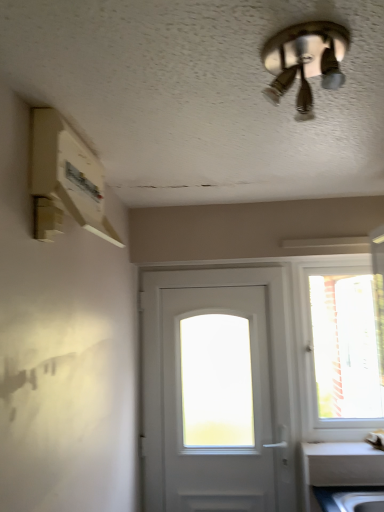
Image resolution: width=384 pixels, height=512 pixels. Describe the element at coordinates (305, 61) in the screenshot. I see `metallic silver ceiling fan at upper center` at that location.

What is the approximate width of transparent glass window at right?

3.34 inches.

I want to click on metallic silver ceiling fan at upper center, so click(305, 61).

Is the surface of white matte door at center in direct contact with transparent glass window at right?

white matte door at center and transparent glass window at right are not in contact.

Which object is positioned more to the right, white matte door at center or transparent glass window at right?

transparent glass window at right is more to the right.

Is white matte door at center shorter than transparent glass window at right?

No.

Is metallic silver ceiling fan at upper center not near transparent glass window at right?

Yes, metallic silver ceiling fan at upper center and transparent glass window at right are quite far apart.

Based on the photo, from the image's perspective, which is below, metallic silver ceiling fan at upper center or transparent glass window at right?

transparent glass window at right appears lower in the image.

How different are the orientations of metallic silver ceiling fan at upper center and transparent glass window at right in degrees?

The facing directions of metallic silver ceiling fan at upper center and transparent glass window at right are 86.8 degrees apart.

Between metallic silver ceiling fan at upper center and transparent glass window at right, which one has more height?

With more height is transparent glass window at right.

Are metallic silver ceiling fan at upper center and white matte door at center far apart?

Yes, metallic silver ceiling fan at upper center and white matte door at center are located far from each other.

Is point (288, 51) positioned behind point (161, 355)?

No, it is not.

Which object is thinner, metallic silver ceiling fan at upper center or white matte door at center?

Thinner between the two is white matte door at center.

Who is smaller, metallic silver ceiling fan at upper center or white matte door at center?

With smaller size is metallic silver ceiling fan at upper center.

How many degrees apart are the facing directions of white matte door at center and metallic silver ceiling fan at upper center?

The facing directions of white matte door at center and metallic silver ceiling fan at upper center are 86.4 degrees apart.

Can you confirm if white matte door at center is taller than metallic silver ceiling fan at upper center?

Correct, white matte door at center is much taller as metallic silver ceiling fan at upper center.

Is white matte door at center surrounding metallic silver ceiling fan at upper center?

No, metallic silver ceiling fan at upper center is not a part of white matte door at center.

Would you say white matte door at center is a long distance from metallic silver ceiling fan at upper center?

Yes, white matte door at center is far from metallic silver ceiling fan at upper center.

Can you tell me how much transparent glass window at right and white matte door at center differ in facing direction?

transparent glass window at right and white matte door at center are facing 0.37 degrees away from each other.

Which is correct: transparent glass window at right is inside white matte door at center, or outside of it?

transparent glass window at right is spatially situated outside white matte door at center.

Does transparent glass window at right appear on the right side of white matte door at center?

Yes, transparent glass window at right is to the right of white matte door at center.

Between point (363, 320) and point (240, 505), which one is positioned in front?

The point (240, 505) is more forward.

In the scene shown: Does transparent glass window at right have a smaller size compared to metallic silver ceiling fan at upper center?

No.

Can you see transparent glass window at right touching metallic silver ceiling fan at upper center?

No, transparent glass window at right is not in contact with metallic silver ceiling fan at upper center.

Identify the location of window that is under the metallic silver ceiling fan at upper center (from a real-world perspective). The height and width of the screenshot is (512, 384). (339, 353).

Which is in front, transparent glass window at right or metallic silver ceiling fan at upper center?

metallic silver ceiling fan at upper center is closer to the camera.

Locate an element on the screen. window on the right of white matte door at center is located at coordinates (339, 353).

Find the location of a particular element. window below the metallic silver ceiling fan at upper center (from a real-world perspective) is located at coordinates (339, 353).

Considering their positions, is metallic silver ceiling fan at upper center positioned closer to white matte door at center than transparent glass window at right?

Among the two, metallic silver ceiling fan at upper center is located nearer to white matte door at center.

Looking at the image, which one is located closer to transparent glass window at right, metallic silver ceiling fan at upper center or white matte door at center?

Among the two, white matte door at center is located nearer to transparent glass window at right.

Estimate the real-world distances between objects in this image. Which object is closer to metallic silver ceiling fan at upper center, white matte door at center or transparent glass window at right?

The object closer to metallic silver ceiling fan at upper center is white matte door at center.

From the image, which object appears to be farther from white matte door at center, transparent glass window at right or metallic silver ceiling fan at upper center?

Among the two, transparent glass window at right is located further to white matte door at center.

Which object lies further to the anchor point transparent glass window at right, white matte door at center or metallic silver ceiling fan at upper center?

metallic silver ceiling fan at upper center lies further to transparent glass window at right than the other object.

Which object lies nearer to the anchor point metallic silver ceiling fan at upper center, transparent glass window at right or white matte door at center?

white matte door at center is positioned closer to the anchor metallic silver ceiling fan at upper center.

Image resolution: width=384 pixels, height=512 pixels. In order to click on door located between metallic silver ceiling fan at upper center and transparent glass window at right in the depth direction in this screenshot , I will do `click(218, 390)`.